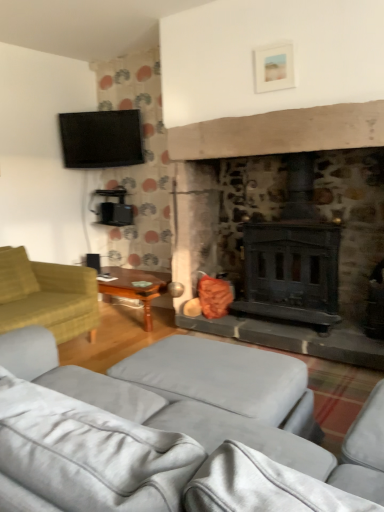
Question: Is light gray fabric studio couch at lower center, the first studio couch when ordered from front to back, bigger than wooden polished table at left?

Choices:
 (A) yes
 (B) no

Answer: (A)

Question: Does light gray fabric studio couch at lower center, arranged as the 2th studio couch when viewed from the back, appear on the right side of wooden polished table at left?

Choices:
 (A) no
 (B) yes

Answer: (B)

Question: Considering the relative positions of light gray fabric studio couch at lower center, the first studio couch when ordered from front to back, and wooden polished table at left in the image provided, is light gray fabric studio couch at lower center, the first studio couch when ordered from front to back, behind wooden polished table at left?

Choices:
 (A) yes
 (B) no

Answer: (B)

Question: From the image's perspective, does light gray fabric studio couch at lower center, the first studio couch when ordered from front to back, appear lower than wooden polished table at left?

Choices:
 (A) no
 (B) yes

Answer: (B)

Question: Is the depth of light gray fabric studio couch at lower center, the first studio couch when ordered from front to back, less than that of wooden polished table at left?

Choices:
 (A) no
 (B) yes

Answer: (B)

Question: From a real-world perspective, is light gray fabric studio couch at lower center, the first studio couch when ordered from front to back, physically above wooden polished table at left?

Choices:
 (A) no
 (B) yes

Answer: (B)

Question: Can you confirm if matte black tv at upper left is smaller than green fabric studio couch at left, placed as the second studio couch when sorted from front to back?

Choices:
 (A) yes
 (B) no

Answer: (A)

Question: Is matte black tv at upper left next to green fabric studio couch at left, which is the 1th studio couch from back to front?

Choices:
 (A) yes
 (B) no

Answer: (B)

Question: Is matte black tv at upper left to the left of green fabric studio couch at left, placed as the second studio couch when sorted from front to back, from the viewer's perspective?

Choices:
 (A) no
 (B) yes

Answer: (A)

Question: From a real-world perspective, is matte black tv at upper left positioned under green fabric studio couch at left, placed as the second studio couch when sorted from front to back, based on gravity?

Choices:
 (A) no
 (B) yes

Answer: (A)

Question: Does matte black tv at upper left come in front of green fabric studio couch at left, which is the 1th studio couch from back to front?

Choices:
 (A) yes
 (B) no

Answer: (B)

Question: From the image's perspective, is matte black tv at upper left above green fabric studio couch at left, placed as the second studio couch when sorted from front to back?

Choices:
 (A) yes
 (B) no

Answer: (A)

Question: Is soft yellow pillow at left surrounded by green fabric studio couch at left, which is the 1th studio couch from back to front?

Choices:
 (A) no
 (B) yes

Answer: (B)